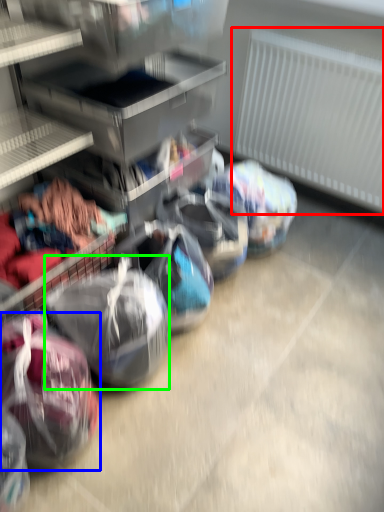
Question: Which is nearer to the radiator (highlighted by a red box)? sack (highlighted by a blue box) or sack (highlighted by a green box).

Choices:
 (A) sack
 (B) sack

Answer: (B)